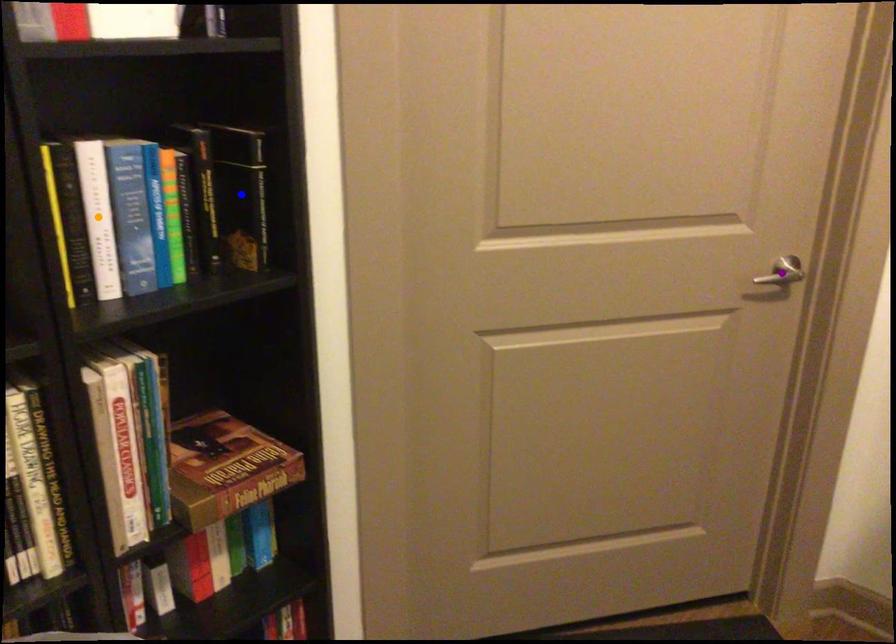
Order these from nearest to farthest:
blue point
orange point
purple point

1. orange point
2. blue point
3. purple point